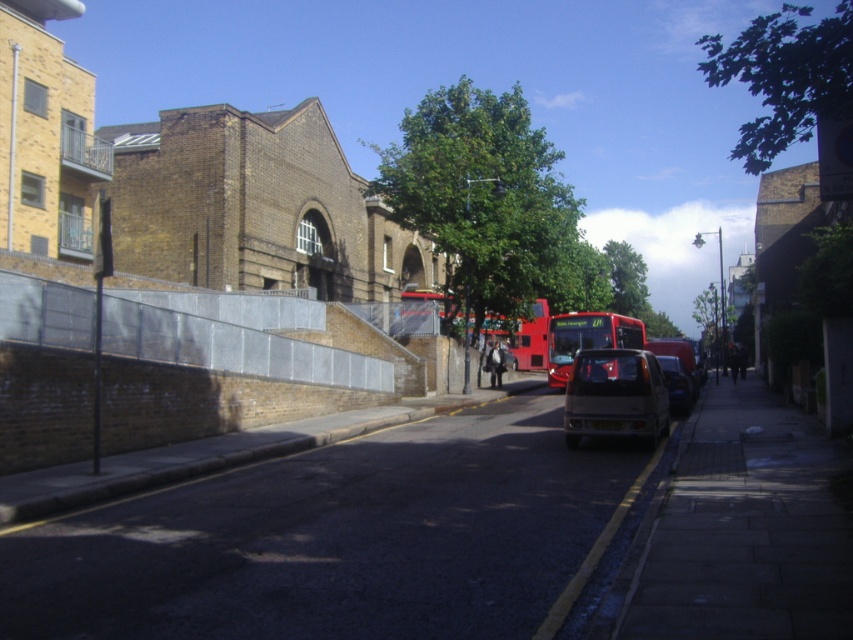
Question: Which point appears closest to the camera in this image?

Choices:
 (A) (589, 404)
 (B) (691, 403)

Answer: (A)

Question: Which point is farther from the camera taking this photo?

Choices:
 (A) (674, 396)
 (B) (578, 372)

Answer: (A)

Question: Which of the following is the closest to the observer?

Choices:
 (A) matte silver hatchback at center
 (B) matte silver van at center

Answer: (A)

Question: Is matte silver hatchback at center smaller than matte silver van at center?

Choices:
 (A) no
 (B) yes

Answer: (A)

Question: Is matte silver hatchback at center positioned before matte silver van at center?

Choices:
 (A) no
 (B) yes

Answer: (B)

Question: Can you confirm if matte silver hatchback at center is positioned to the right of matte silver van at center?

Choices:
 (A) no
 (B) yes

Answer: (A)